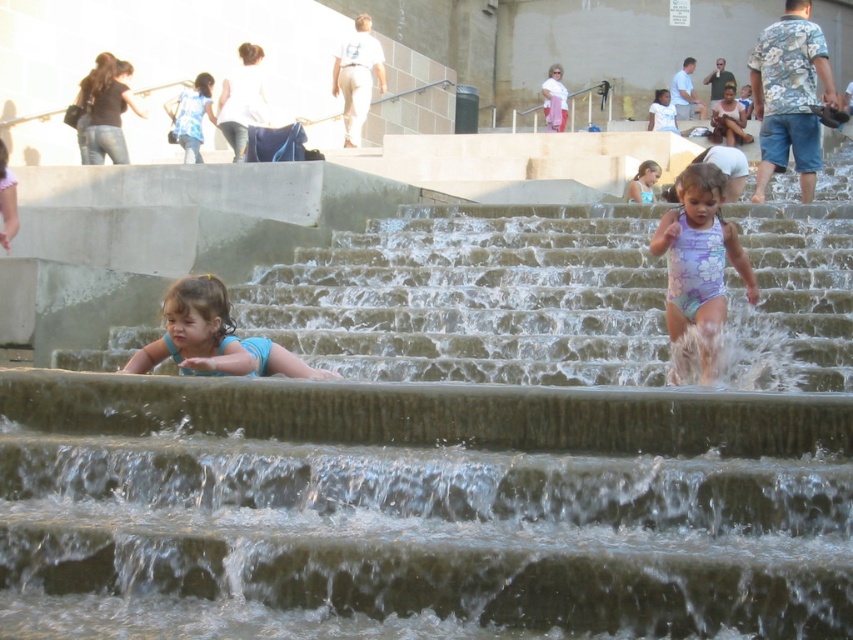
Question: Among these objects, which one is farthest from the camera?

Choices:
 (A) blue fabric swimsuit at lower left
 (B) purple floral swimsuit at right
 (C) blue fabric dress at upper center
 (D) smooth concrete stairs at center

Answer: (C)

Question: Among these objects, which one is nearest to the camera?

Choices:
 (A) blue fabric dress at upper center
 (B) smooth concrete stairs at center
 (C) blue floral swimsuit at upper center
 (D) purple floral swimsuit at right

Answer: (B)

Question: From the image, what is the correct spatial relationship of smooth concrete stairs at center in relation to purple floral swimsuit at right?

Choices:
 (A) right
 (B) left

Answer: (A)

Question: Estimate the real-world distances between objects in this image. Which object is farther from the blue fabric dress at upper center?

Choices:
 (A) smooth concrete stairs at center
 (B) blue floral swimsuit at upper center
 (C) blue fabric swimsuit at lower left

Answer: (C)

Question: Does smooth concrete stairs at center come in front of blue floral swimsuit at upper center?

Choices:
 (A) yes
 (B) no

Answer: (A)

Question: Does purple floral swimsuit at right lie behind blue fabric swimsuit at lower left?

Choices:
 (A) yes
 (B) no

Answer: (A)